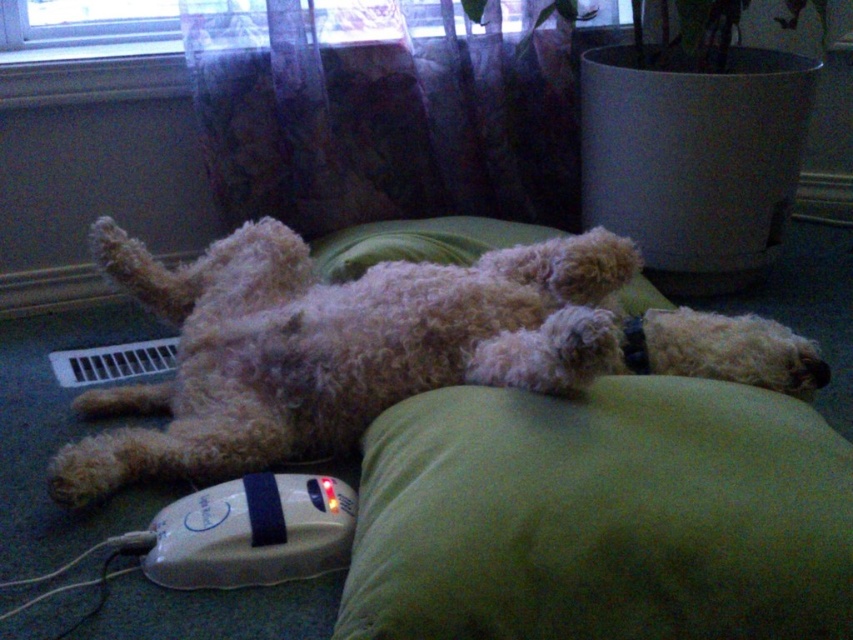
You are a pet groomer who needs to reach the white plastic remote at lower left to turn off the grooming device. The fuzzy beige dog at center is in your way. Can you step over the dog without bending down?

The fuzzy beige dog at center is taller than the white plastic remote at lower left. Since the dog is taller, you would need to bend down to step over it to reach the white plastic remote at lower left.

You are a robotic pet groomer positioned at the origin point of the room. The fuzzy beige dog at center is lying on a green cushion. To reach the dog, you need to move in a straight line from your current position. Will you encounter any obstacles along the path? Please refer to the coordinates provided in the scene description.

The fuzzy beige dog at center is located at coordinates point (335, 346). Since there are no other objects mentioned in the scene description between the robotic groomer and the dog, the path should be clear of obstacles.